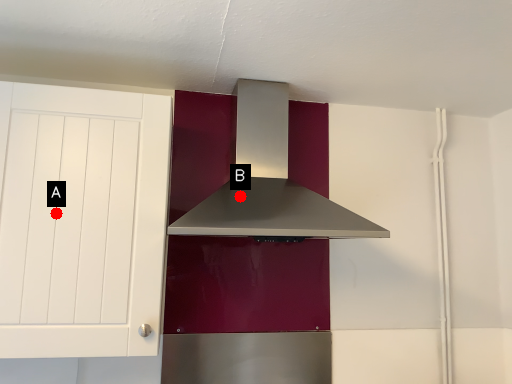
Question: Two points are circled on the image, labeled by A and B beside each circle. Which point is farther from the camera taking this photo?

Choices:
 (A) A is further
 (B) B is further

Answer: (B)